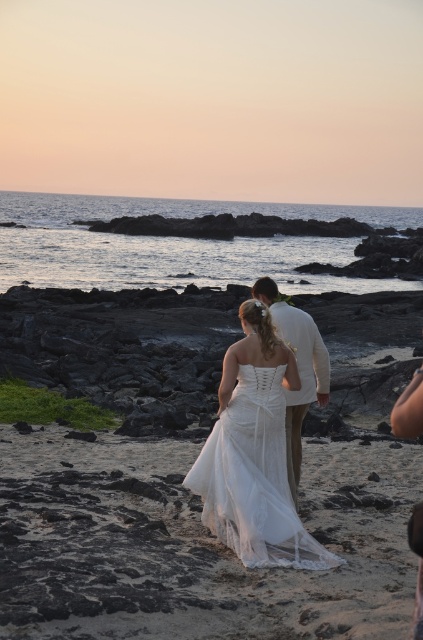
Can you confirm if white lace dress at center is shorter than white satin dress at center?

Yes.

Which is behind, point (230, 628) or point (225, 541)?

Positioned behind is point (225, 541).

Does point (340, 512) come behind point (271, 554)?

That is True.

Locate an element on the screen. The image size is (423, 640). white lace dress at center is located at coordinates (194, 545).

What do you see at coordinates (194, 545) in the screenshot? I see `white lace dress at center` at bounding box center [194, 545].

Can you confirm if white lace dress at center is wider than light beige cotton suit at center?

Correct, the width of white lace dress at center exceeds that of light beige cotton suit at center.

The width and height of the screenshot is (423, 640). In order to click on white lace dress at center in this screenshot , I will do pyautogui.click(x=194, y=545).

Does white satin dress at center appear on the right side of light beige cotton suit at center?

In fact, white satin dress at center is to the left of light beige cotton suit at center.

You are a GUI agent. You are given a task and a screenshot of the screen. Output one action in this format:
    pyautogui.click(x=<x>, y=<y>)
    Task: Click on the white satin dress at center
    This screenshot has height=640, width=423.
    Given the screenshot: What is the action you would take?
    253,477